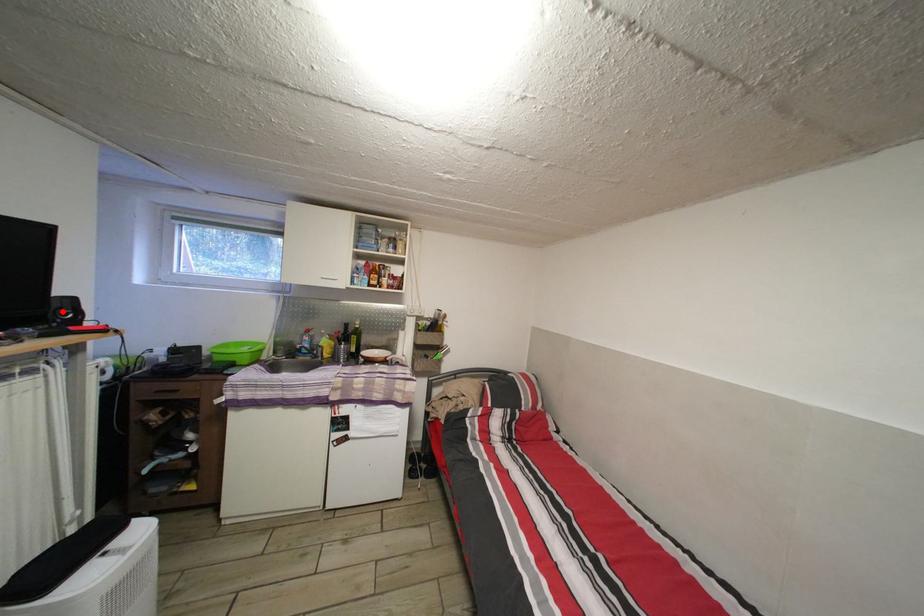
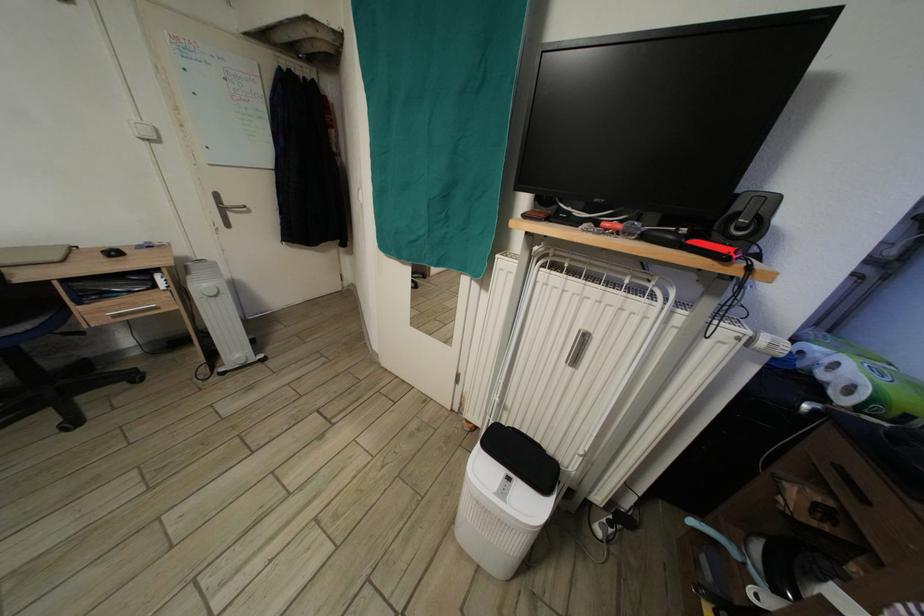
Find the pixel in the second image that matches the highlighted location in the first image.

(744, 214)